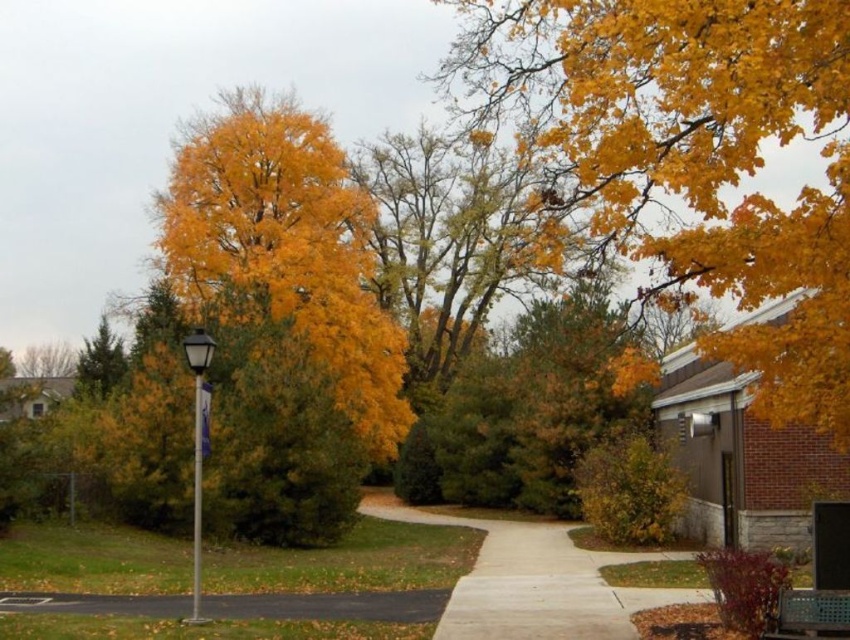
Question: Which is nearer to the black asphalt pavement at lower left?

Choices:
 (A) yellow matte tree at upper right
 (B) silver metallic street sign at left

Answer: (B)

Question: Which point is farther to the camera?

Choices:
 (A) yellow matte tree at upper right
 (B) golden yellow leaves at center

Answer: (B)

Question: Is golden yellow leaves at center smaller than silver metallic street sign at left?

Choices:
 (A) no
 (B) yes

Answer: (A)

Question: Does yellow matte tree at upper right appear over silver metallic street sign at left?

Choices:
 (A) no
 (B) yes

Answer: (B)

Question: Estimate the real-world distances between objects in this image. Which object is farther from the yellow matte tree at upper right?

Choices:
 (A) golden yellow leaves at center
 (B) black asphalt pavement at lower left
 (C) silver metallic street sign at left
 (D) wooden park bench at lower right

Answer: (B)

Question: From the image, what is the correct spatial relationship of yellow matte tree at upper right in relation to wooden park bench at lower right?

Choices:
 (A) left
 (B) right

Answer: (B)